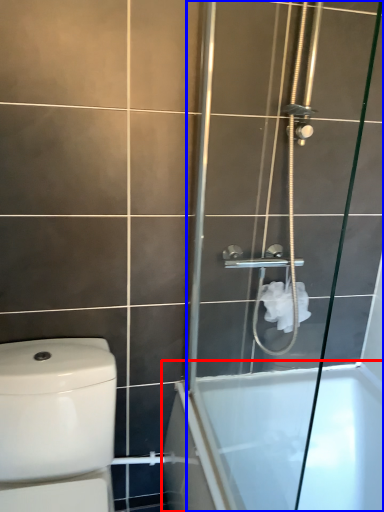
Question: Which object is closer to the camera taking this photo, bathtub (highlighted by a red box) or screen door (highlighted by a blue box)?

Choices:
 (A) bathtub
 (B) screen door

Answer: (B)